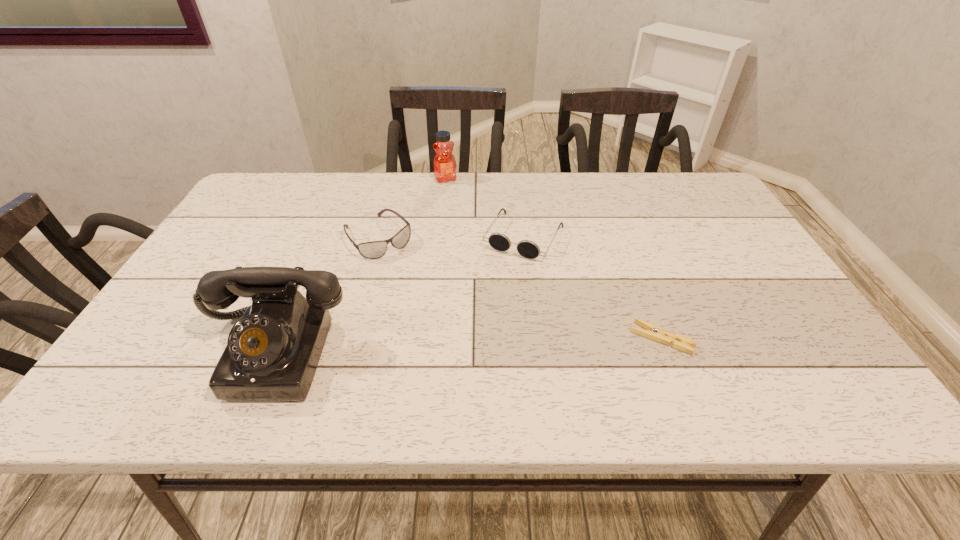
The height and width of the screenshot is (540, 960). I want to click on free space on the desktop that is between the telephone and the clothespin and is positioned on the lenses of the left sunglasses, so click(x=479, y=345).

Where is `free space on the desktop that is between the tallest object and the shortest object and is positioned on the front label of the second tallest object`? The height and width of the screenshot is (540, 960). free space on the desktop that is between the tallest object and the shortest object and is positioned on the front label of the second tallest object is located at coordinates (518, 343).

Identify the location of free spot on the desktop that is between the telephone and the shortest object and is positioned on the front-facing side of the right sunglasses. (463, 345).